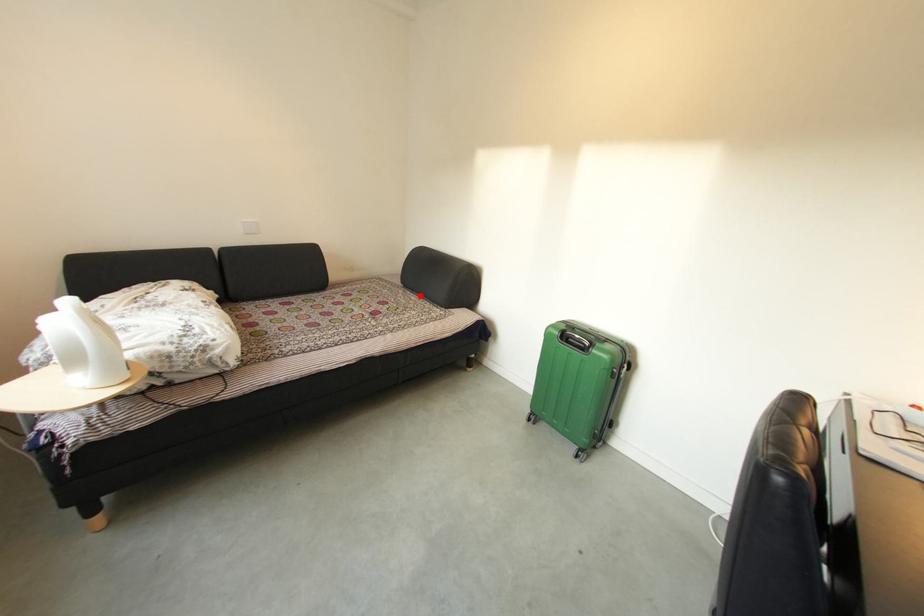
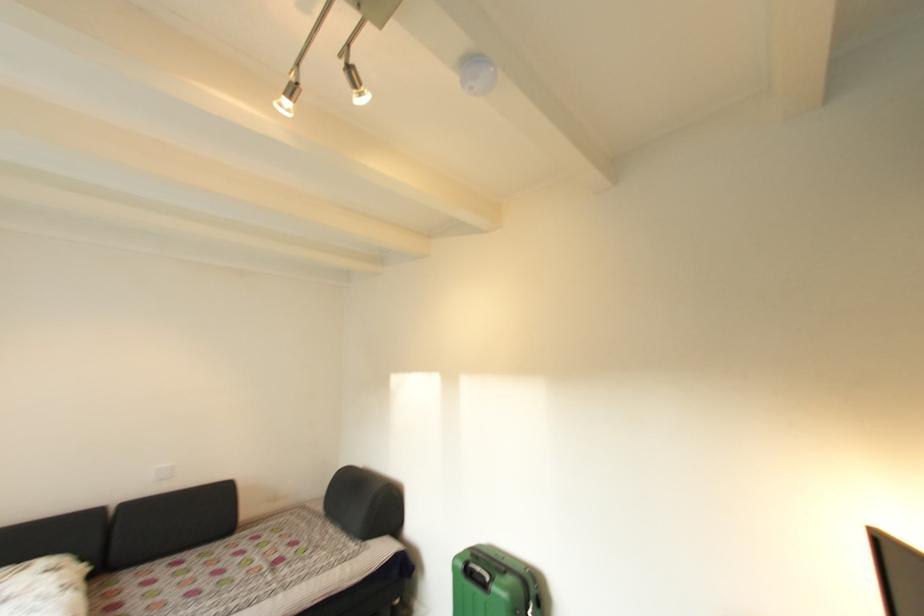
Where in the second image is the point corresponding to the highlighted location from the first image?

(341, 525)